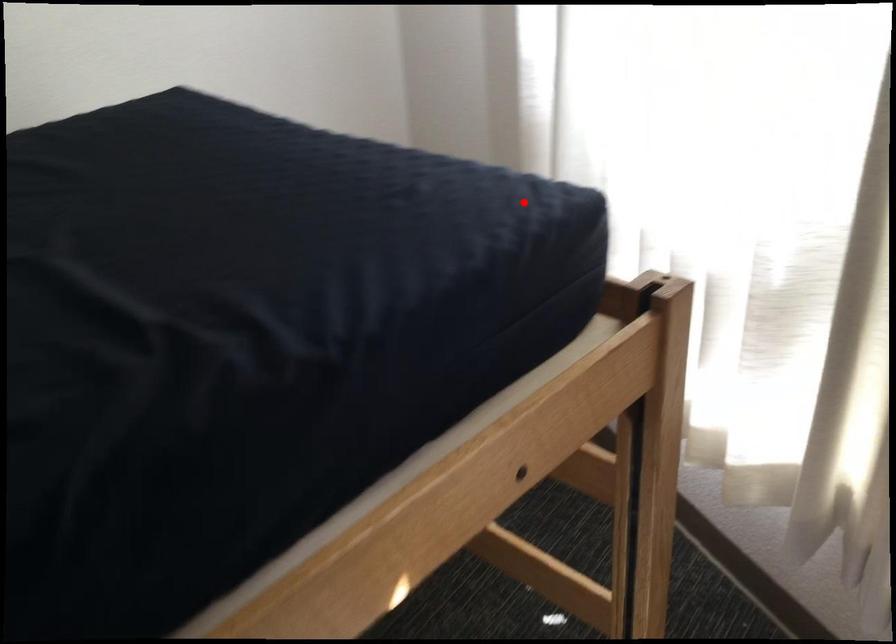
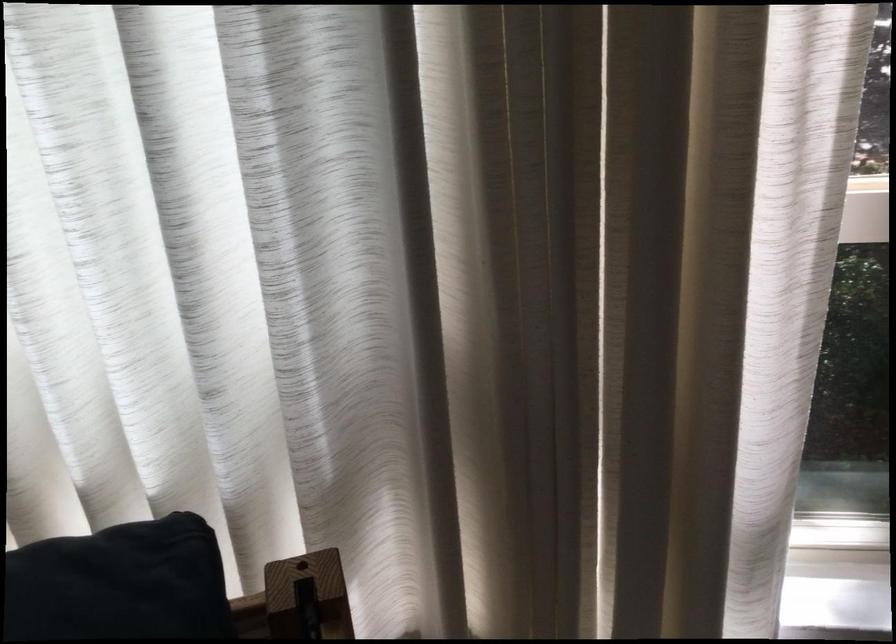
Question: I am providing you with two images of the same scene from different viewpoints. A red point is shown in image1. For the corresponding object point in image2, is it positioned nearer or farther from the camera?

Choices:
 (A) Nearer
 (B) Farther

Answer: (A)